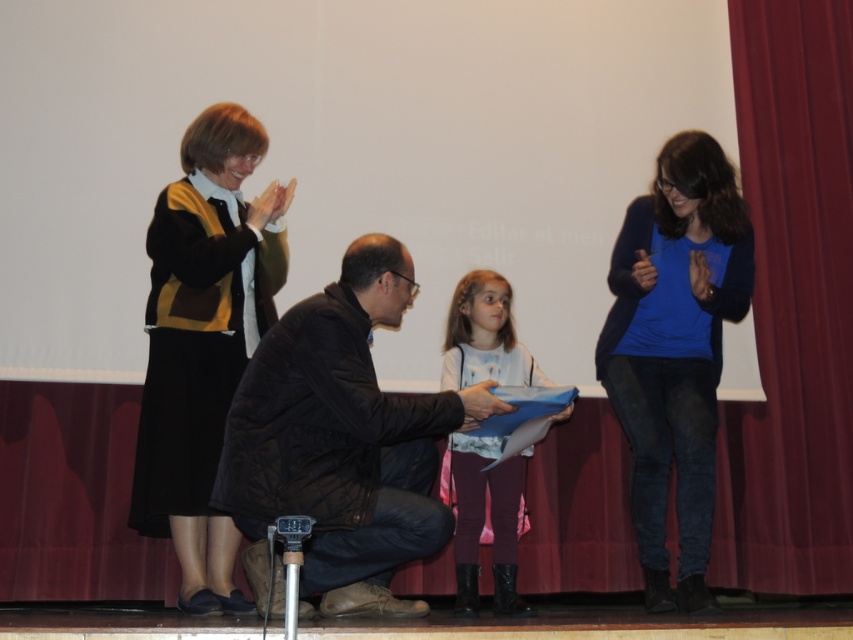
Does point (345, 550) lie in front of point (695, 600)?

Yes.

Identify the location of dark brown leather jacket at center. (343, 438).

Does blue cotton shirt at right have a larger size compared to pink fabric dress at center?

Correct, blue cotton shirt at right is larger in size than pink fabric dress at center.

Who is taller, blue cotton shirt at right or pink fabric dress at center?

Standing taller between the two is blue cotton shirt at right.

Which is in front, point (672, 280) or point (508, 353)?

Point (672, 280)

Image resolution: width=853 pixels, height=640 pixels. Find the location of `blue cotton shirt at right`. blue cotton shirt at right is located at coordinates (675, 349).

Does dark brown leather jacket at center have a lesser height compared to pink fabric dress at center?

Yes, dark brown leather jacket at center is shorter than pink fabric dress at center.

Is dark brown leather jacket at center closer to the viewer compared to pink fabric dress at center?

That is True.

Who is more distant from viewer, (296, 310) or (460, 500)?

The point (460, 500) is behind.

Where is `dark brown leather jacket at center`? dark brown leather jacket at center is located at coordinates (343, 438).